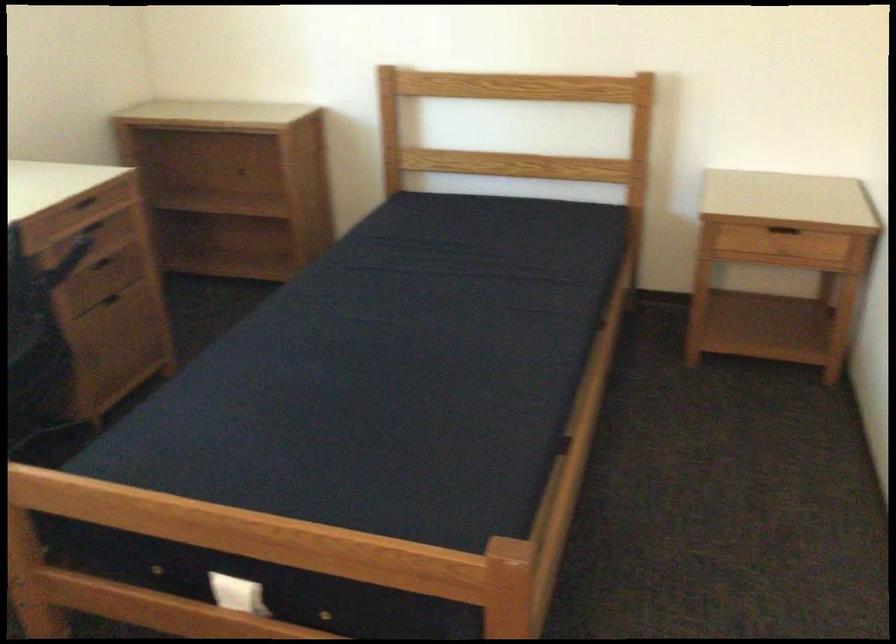
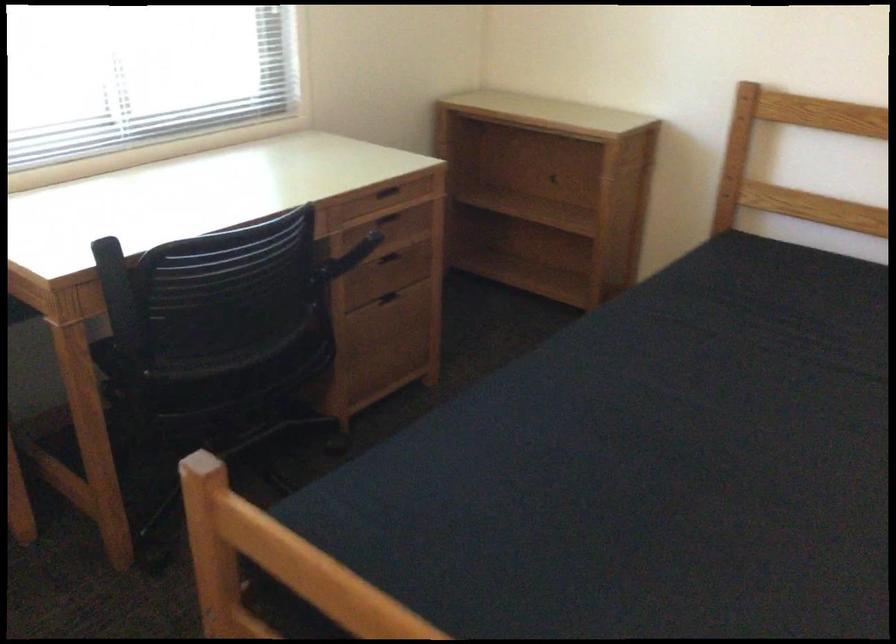
Which direction would the cameraman need to move to produce the second image?

The cameraman moved toward left, forward.